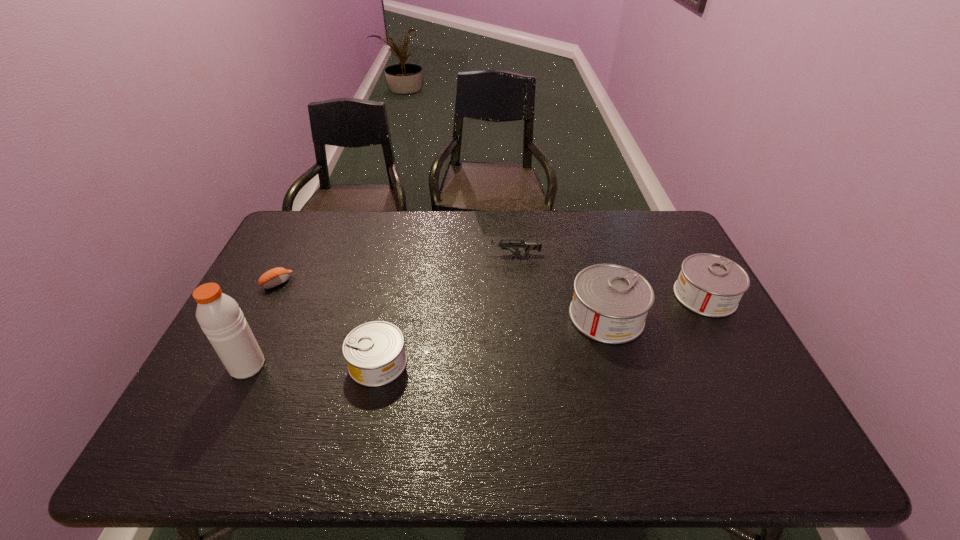
Find the location of a particular element. The width and height of the screenshot is (960, 540). free spot that satisfies the following two spatial constraints: 1. on the front side of the shaker; 2. on the right side of the shortest object is located at coordinates (236, 366).

Image resolution: width=960 pixels, height=540 pixels. I want to click on free space that satisfies the following two spatial constraints: 1. on the back side of the second can from left to right; 2. on the right side of the shaker, so click(271, 316).

Where is `vacant space that satisfies the following two spatial constraints: 1. aimed along the barrel of the third object from right to left; 2. on the front side of the sushi`? The height and width of the screenshot is (540, 960). vacant space that satisfies the following two spatial constraints: 1. aimed along the barrel of the third object from right to left; 2. on the front side of the sushi is located at coordinates (515, 282).

This screenshot has width=960, height=540. What are the coordinates of `vacant space that satisfies the following two spatial constraints: 1. aimed along the barrel of the fourth object from left to right; 2. on the back side of the third tallest object` in the screenshot? It's located at (516, 296).